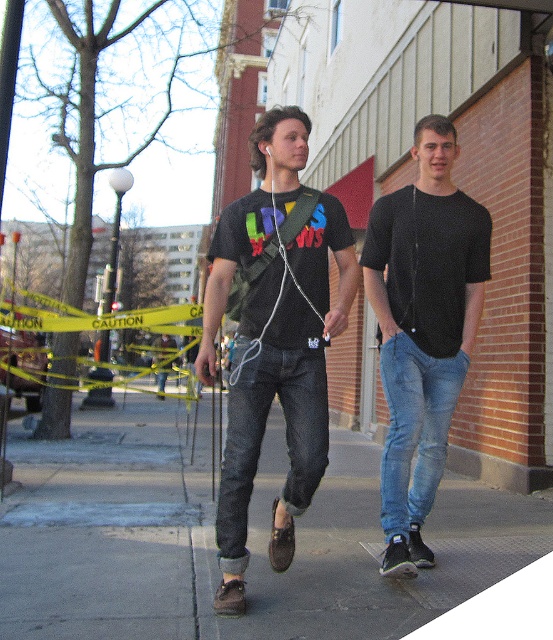
Measure the distance from matte black t-shirt at center to black matte t-shirt at center.

matte black t-shirt at center and black matte t-shirt at center are 70.59 centimeters apart.

Does point (352, 252) lie in front of point (410, 417)?

Yes, it is.

You are a GUI agent. You are given a task and a screenshot of the screen. Output one action in this format:
    pyautogui.click(x=<x>, y=<y>)
    Task: Click on the matte black t-shirt at center
    The image size is (553, 640).
    Given the screenshot: What is the action you would take?
    pyautogui.click(x=274, y=337)

Is point (478, 586) positioned in front of point (472, 298)?

That is True.

Who is lower down, smooth concrete sidewalk at center or black matte t-shirt at center?

Positioned lower is smooth concrete sidewalk at center.

Is point (508, 518) behind point (418, 397)?

Yes, point (508, 518) is behind point (418, 397).

Where is `smooth concrete sidewalk at center`? This screenshot has width=553, height=640. smooth concrete sidewalk at center is located at coordinates (213, 541).

Between black matte t-shirt at center and denim at center, which one appears on the left side from the viewer's perspective?

Positioned to the left is denim at center.

Between black matte t-shirt at center and denim at center, which one has less height?

With less height is denim at center.

Locate an element on the screen. The image size is (553, 640). black matte t-shirt at center is located at coordinates (422, 328).